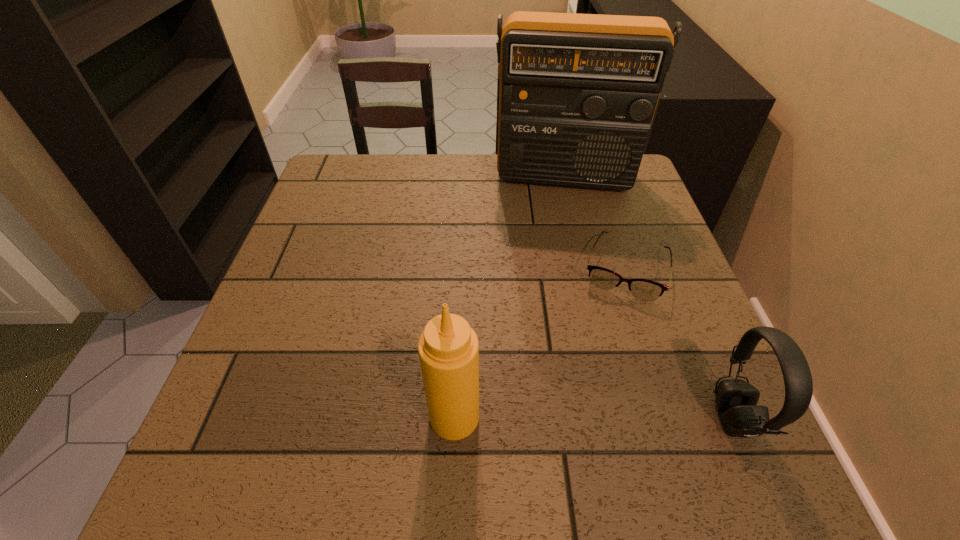
You are a GUI agent. You are given a task and a screenshot of the screen. Output one action in this format:
    pyautogui.click(x=<x>, y=<y>)
    Task: Click on the vacant space positioned 0.170m on the front-facing side of the third tallest object
    The image size is (960, 540).
    Given the screenshot: What is the action you would take?
    pyautogui.click(x=616, y=417)

Locate an element on the screen. The image size is (960, 540). free point located 0.090m on the face of the spectacles is located at coordinates (610, 334).

Where is `free location located on the face of the spectacles`? free location located on the face of the spectacles is located at coordinates (594, 393).

At what (x,y) coordinates should I click in order to perform the action: click on vacant area situated on the face of the spectacles. Please return your answer as a coordinate pair (x, y). The width and height of the screenshot is (960, 540). Looking at the image, I should click on (610, 334).

Find the location of a particular element. free region located on the front-facing side of the radio receiver is located at coordinates (557, 222).

At what (x,y) coordinates should I click in order to perform the action: click on free space located 0.170m on the front-facing side of the radio receiver. Please return your answer as a coordinate pair (x, y). The height and width of the screenshot is (540, 960). Looking at the image, I should click on (557, 238).

At what (x,y) coordinates should I click in order to perform the action: click on vacant space located on the front-facing side of the radio receiver. Please return your answer as a coordinate pair (x, y). The width and height of the screenshot is (960, 540). Looking at the image, I should click on (555, 305).

Locate an element on the screen. This screenshot has width=960, height=540. object situated at the far edge is located at coordinates (577, 95).

Locate an element on the screen. The height and width of the screenshot is (540, 960). condiment situated at the near edge is located at coordinates (448, 348).

Image resolution: width=960 pixels, height=540 pixels. In order to click on headset that is positioned at the near edge in this screenshot , I will do `click(736, 400)`.